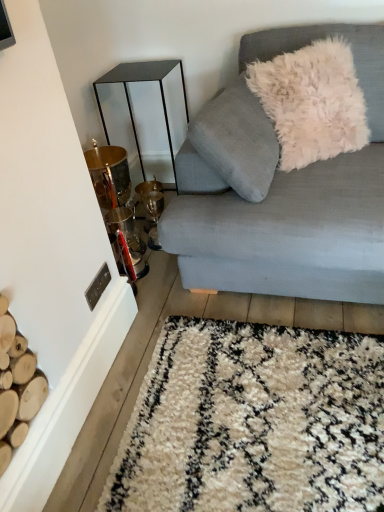
Question: From a real-world perspective, is white fluffy pillow at upper right over light blue fabric couch at upper right?

Choices:
 (A) no
 (B) yes

Answer: (B)

Question: From the image's perspective, is white fluffy pillow at upper right over light blue fabric couch at upper right?

Choices:
 (A) yes
 (B) no

Answer: (A)

Question: Could light blue fabric couch at upper right be considered to be inside white fluffy pillow at upper right?

Choices:
 (A) yes
 (B) no

Answer: (B)

Question: Is white fluffy pillow at upper right not inside light blue fabric couch at upper right?

Choices:
 (A) no
 (B) yes

Answer: (A)

Question: Considering the relative positions of white fluffy pillow at upper right and light blue fabric couch at upper right in the image provided, is white fluffy pillow at upper right to the right of light blue fabric couch at upper right from the viewer's perspective?

Choices:
 (A) no
 (B) yes

Answer: (B)

Question: In terms of height, does metallic gold table at left look taller or shorter compared to white fluffy pillow at upper right?

Choices:
 (A) tall
 (B) short

Answer: (A)

Question: Is point (168, 129) closer or farther from the camera than point (291, 53)?

Choices:
 (A) closer
 (B) farther

Answer: (B)

Question: In the image, is metallic gold table at left on the left side or the right side of white fluffy pillow at upper right?

Choices:
 (A) right
 (B) left

Answer: (B)

Question: From a real-world perspective, is metallic gold table at left above or below white fluffy pillow at upper right?

Choices:
 (A) below
 (B) above

Answer: (A)

Question: Is point (380, 284) positioned closer to the camera than point (327, 110)?

Choices:
 (A) farther
 (B) closer

Answer: (B)

Question: In the image, is light blue fabric couch at upper right positioned in front of or behind white fluffy pillow at upper right?

Choices:
 (A) front
 (B) behind

Answer: (A)

Question: In terms of size, does light blue fabric couch at upper right appear bigger or smaller than white fluffy pillow at upper right?

Choices:
 (A) small
 (B) big

Answer: (B)

Question: Is light blue fabric couch at upper right wider or thinner than white fluffy pillow at upper right?

Choices:
 (A) wide
 (B) thin

Answer: (A)

Question: Is light blue fabric couch at upper right to the left or to the right of metallic gold table at left in the image?

Choices:
 (A) left
 (B) right

Answer: (B)

Question: Is light blue fabric couch at upper right bigger or smaller than metallic gold table at left?

Choices:
 (A) big
 (B) small

Answer: (A)